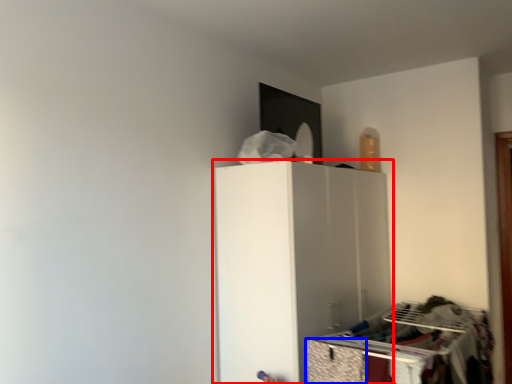
Question: Which object appears farthest to the camera in this image, furniture (highlighted by a red box) or drawer (highlighted by a blue box)?

Choices:
 (A) furniture
 (B) drawer

Answer: (A)